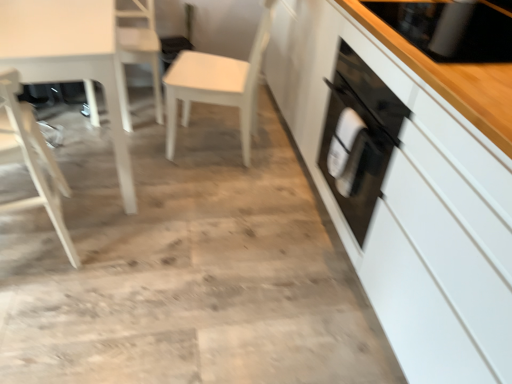
The image size is (512, 384). Find the location of `vacant space underneath white matte chair at center, the 1th chair viewed from the right (from a real-world perspective)`. vacant space underneath white matte chair at center, the 1th chair viewed from the right (from a real-world perspective) is located at coordinates (223, 139).